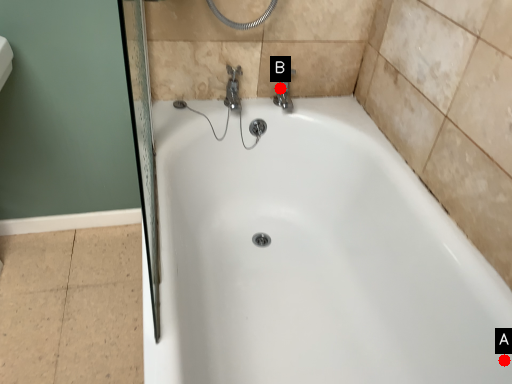
Question: Two points are circled on the image, labeled by A and B beside each circle. Among these points, which one is nearest to the camera?

Choices:
 (A) A is closer
 (B) B is closer

Answer: (A)